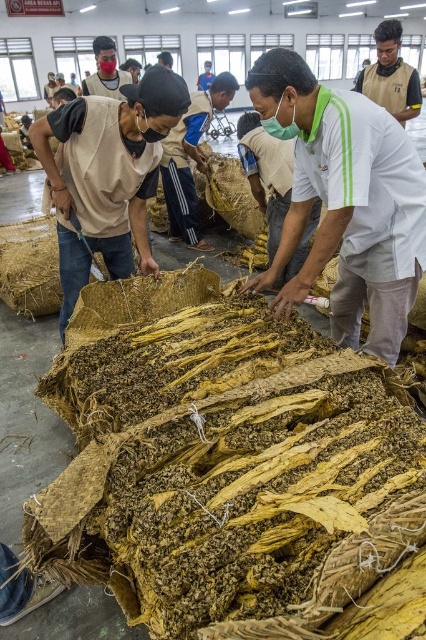
Which is in front, point (186, 147) or point (382, 72)?

Point (382, 72) is in front.

Is point (184, 220) positioned in front of point (368, 74)?

No, it is behind (368, 74).

You are a GUI agent. You are given a task and a screenshot of the screen. Output one action in this format:
    pyautogui.click(x=<x>, y=<y>)
    Task: Click on the matte beige shirt at center
    
    Given the screenshot: What is the action you would take?
    pyautogui.click(x=190, y=160)

Which of these two, beige fabric mask at left or tan fabric vest at upper right, stands taller?

Standing taller between the two is tan fabric vest at upper right.

Does beige fabric mask at left appear over tan fabric vest at upper right?

Actually, beige fabric mask at left is below tan fabric vest at upper right.

Is point (114, 275) positioned in front of point (419, 109)?

That is True.

The height and width of the screenshot is (640, 426). In order to click on beige fabric mask at left in this screenshot , I will do `click(106, 176)`.

Measure the distance from white cotton shirt at center to matte black mask at upper center.

They are 15.10 feet apart.

Based on the photo, is white cotton shirt at center shorter than matte black mask at upper center?

No, white cotton shirt at center is not shorter than matte black mask at upper center.

Is point (391, 330) farther from viewer compared to point (112, 72)?

No, it is in front of (112, 72).

In order to click on white cotton shirt at center in this screenshot , I will do `click(345, 202)`.